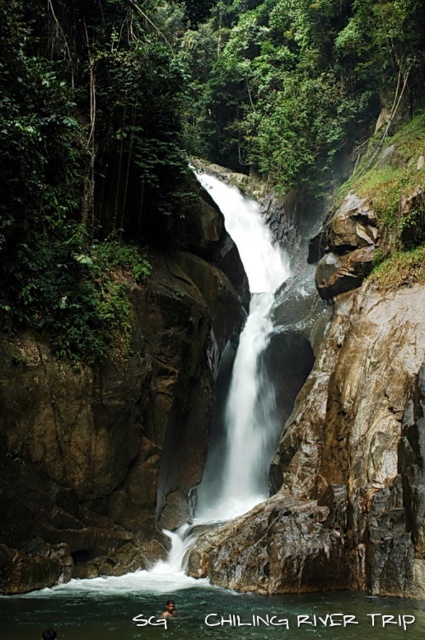
Is white smooth waterfall at center to the right of dark skin human at center from the viewer's perspective?

Yes, white smooth waterfall at center is to the right of dark skin human at center.

You are a GUI agent. You are given a task and a screenshot of the screen. Output one action in this format:
    pyautogui.click(x=<x>, y=<y>)
    Task: Click on the white smooth waterfall at center
    
    Given the screenshot: What is the action you would take?
    pyautogui.click(x=243, y=369)

What do you see at coordinates (243, 369) in the screenshot? This screenshot has width=425, height=640. I see `white smooth waterfall at center` at bounding box center [243, 369].

Where is `white smooth waterfall at center`? The width and height of the screenshot is (425, 640). white smooth waterfall at center is located at coordinates (243, 369).

Can you confirm if clear water at center is taller than white smooth waterfall at center?

No.

Is clear water at center shorter than white smooth waterfall at center?

Indeed, clear water at center has a lesser height compared to white smooth waterfall at center.

Does point (112, 586) come in front of point (240, 442)?

Yes, point (112, 586) is closer to viewer.

You are a GUI agent. You are given a task and a screenshot of the screen. Output one action in this format:
    pyautogui.click(x=<x>, y=<y>)
    Task: Click on the clear water at center
    
    Given the screenshot: What is the action you would take?
    pyautogui.click(x=203, y=612)

Does clear water at center have a greater height compared to brown textured hair at center?

Yes, clear water at center is taller than brown textured hair at center.

Who is more forward, (263, 614) or (167, 605)?

Positioned in front is point (263, 614).

Locate an element on the screen. This screenshot has height=640, width=425. clear water at center is located at coordinates (203, 612).